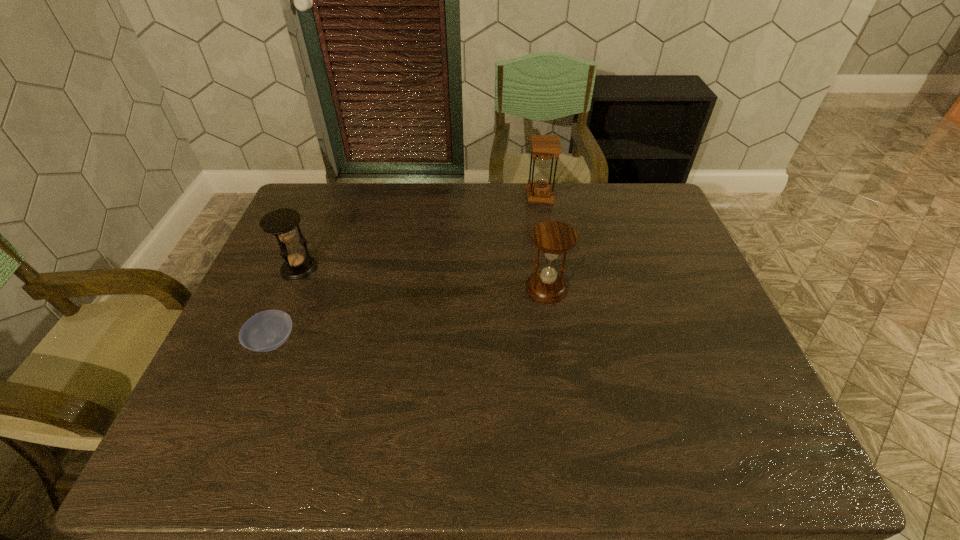
Image resolution: width=960 pixels, height=540 pixels. In order to click on vacant space at the far edge of the desktop in this screenshot , I will do `click(354, 193)`.

In the image, there is a desktop. Where is `vacant region at the near edge`? The height and width of the screenshot is (540, 960). vacant region at the near edge is located at coordinates (535, 459).

In the image, there is a desktop. In order to click on vacant space at the left edge in this screenshot , I will do `click(253, 402)`.

Where is `free space at the right edge of the desktop`? Image resolution: width=960 pixels, height=540 pixels. free space at the right edge of the desktop is located at coordinates (673, 291).

At what (x,y) coordinates should I click in order to perform the action: click on vacant space that is in between the farthest hourglass and the bowl. Please return your answer as a coordinate pair (x, y). This screenshot has height=540, width=960. Looking at the image, I should click on (406, 269).

Locate an element on the screen. The width and height of the screenshot is (960, 540). vacant area that lies between the leftmost hourglass and the shortest object is located at coordinates (286, 305).

Identify the location of vacant region between the leftmost hourglass and the nearest object. (286, 305).

This screenshot has width=960, height=540. What are the coordinates of `the second closest object relative to the farthest object` in the screenshot? It's located at (281, 222).

Point out which object is positioned as the third nearest to the farthest hourglass. Please provide its 2D coordinates. Your answer should be formatted as a tuple, i.e. [(x, y)], where the tuple contains the x and y coordinates of a point satisfying the conditions above.

[(265, 331)]

The image size is (960, 540). In order to click on hourglass identified as the closest to the farthest object in this screenshot , I will do `click(554, 238)`.